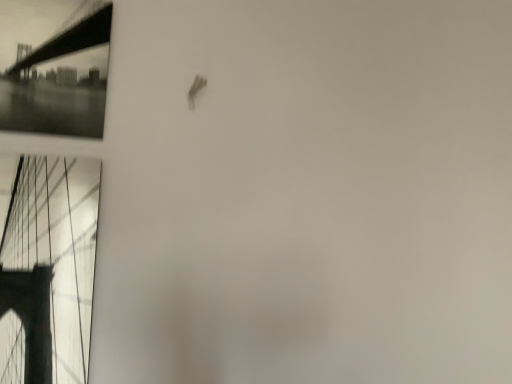
Question: Is black glossy bridge at upper left wider or thinner than metallic bridge at left?

Choices:
 (A) wide
 (B) thin

Answer: (B)

Question: From a real-world perspective, is black glossy bridge at upper left physically located above or below metallic bridge at left?

Choices:
 (A) above
 (B) below

Answer: (A)

Question: Which is correct: black glossy bridge at upper left is inside metallic bridge at left, or outside of it?

Choices:
 (A) inside
 (B) outside

Answer: (B)

Question: Which is correct: metallic bridge at left is inside black glossy bridge at upper left, or outside of it?

Choices:
 (A) inside
 (B) outside

Answer: (B)

Question: From the image's perspective, relative to black glossy bridge at upper left, is metallic bridge at left above or below?

Choices:
 (A) below
 (B) above

Answer: (A)

Question: Relative to black glossy bridge at upper left, is metallic bridge at left in front or behind?

Choices:
 (A) front
 (B) behind

Answer: (A)

Question: In terms of width, does metallic bridge at left look wider or thinner when compared to black glossy bridge at upper left?

Choices:
 (A) thin
 (B) wide

Answer: (B)